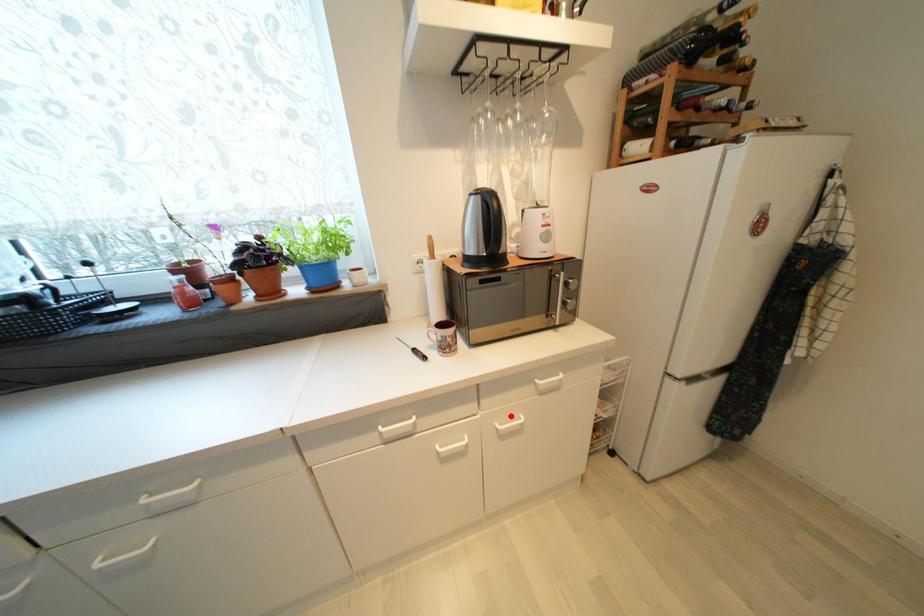
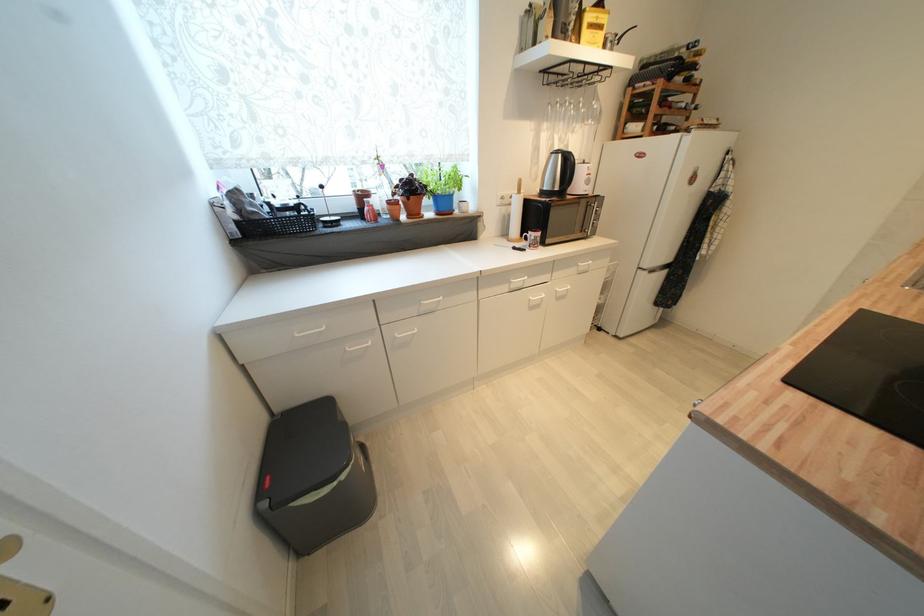
Question: I am providing you with two images of the same scene from different viewpoints. A red point is marked on the first image. At the location where the point appears in image 1, is it still visible in image 2?

Choices:
 (A) Yes
 (B) No

Answer: (A)